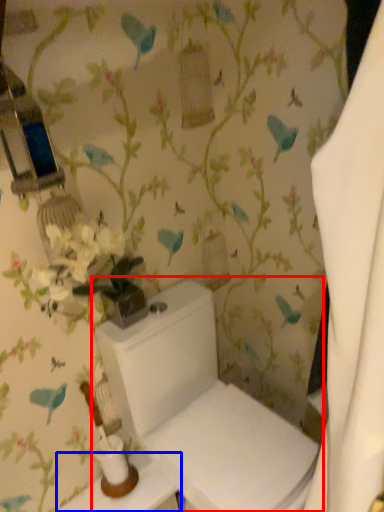
Question: Among these objects, which one is farthest to the camera, toilet (highlighted by a red box) or table (highlighted by a blue box)?

Choices:
 (A) toilet
 (B) table

Answer: (B)